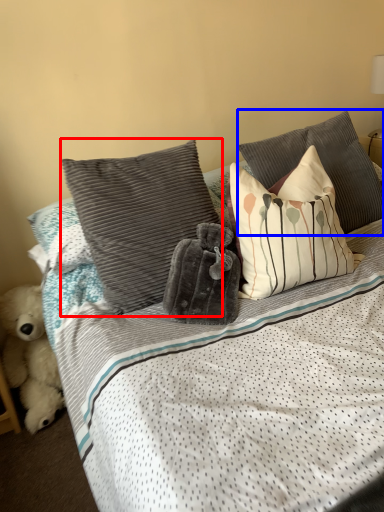
Question: Which object is further to the camera taking this photo, pillow (highlighted by a red box) or pillow (highlighted by a blue box)?

Choices:
 (A) pillow
 (B) pillow

Answer: (B)